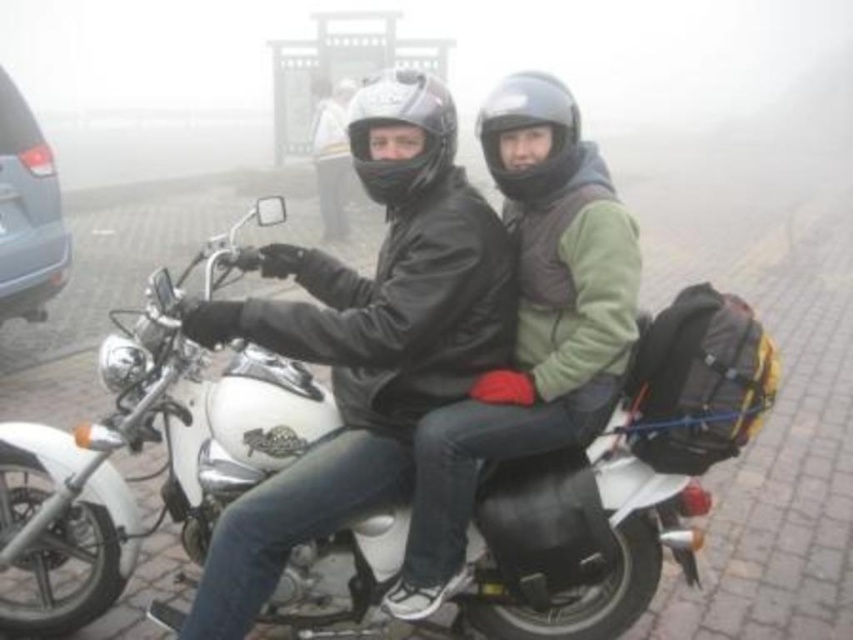
You are a delivery person who needs to secure a package on the motorcycle. The package is the same size as the textured fabric backpack at rear. Where should you place the package so it doesn not interfere with the metallic gray van at left?

The textured fabric backpack at rear is below the metallic gray van at left, so placing the package on the rear of the motorcycle would keep it safely below the metallic gray van at left, avoiding interference.

You are a pedestrian standing on the sidewalk and see the metallic gray van at left and the glossy black helmet at center. Which object is closer to you?

The metallic gray van at left is closer to you because the glossy black helmet at center is behind it.

Based on the photo, you are a pedestrian standing next to the metallic gray van at left. You want to cross the road to reach a bus stop located behind the camera. The motorcycle is approaching from your right. Can you safely cross the road before the motorcycle arrives?

The metallic gray van at left and camera are 5.53 meters apart. Since the motorcycle is approaching from your right, you need to assess if the distance between you and the camera allows enough time to cross safely. However, without knowing the motorcycle speed, it is impossible to determine if 5.53 meters is sufficient. Wait for the motorcycle to pass before attempting to cross.